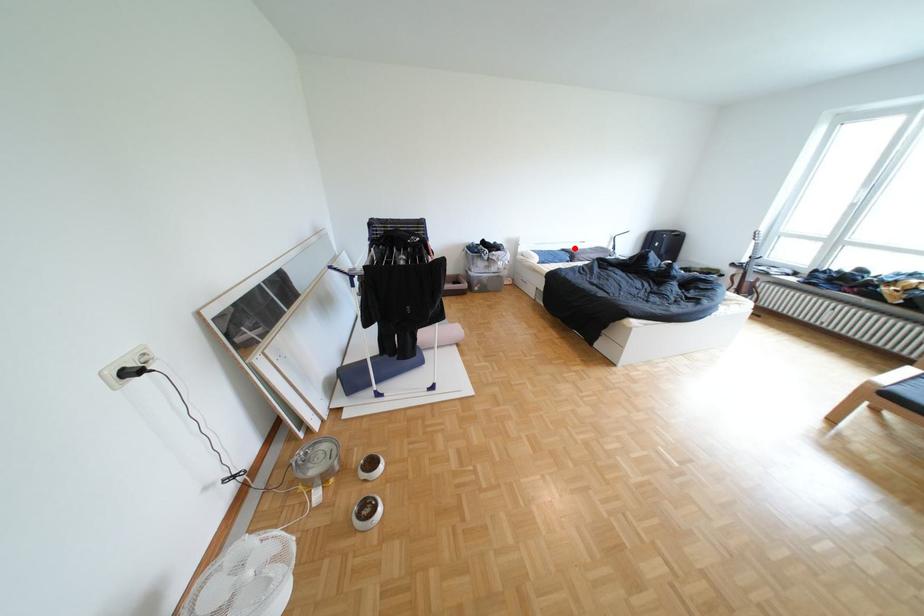
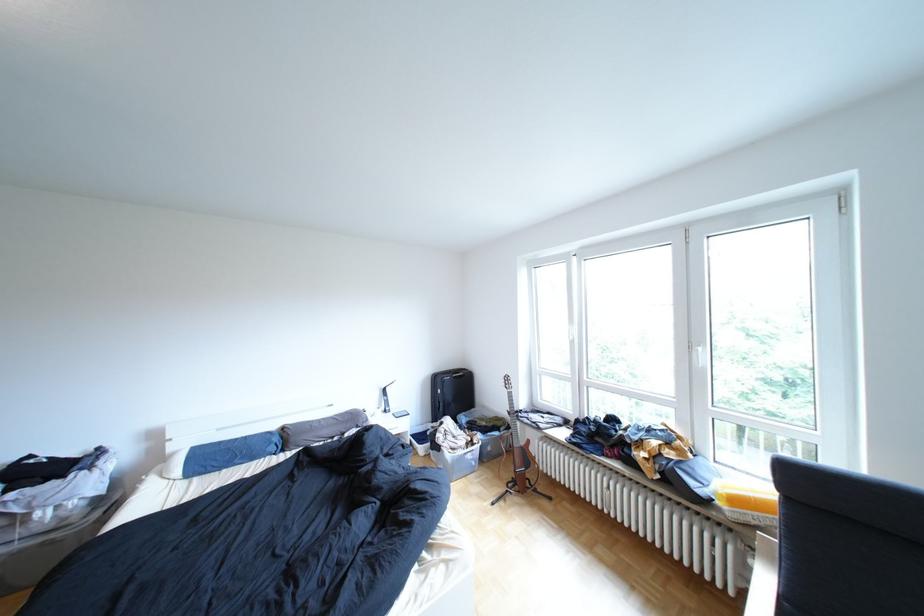
Where in the second image is the point corresponding to the highlighted location from the first image?

(289, 427)